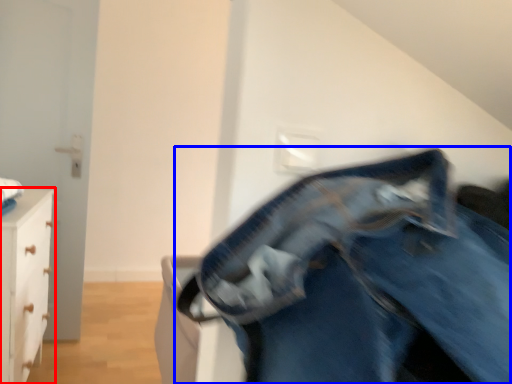
Question: Among these objects, which one is farthest to the camera, chest of drawers (highlighted by a red box) or trousers (highlighted by a blue box)?

Choices:
 (A) chest of drawers
 (B) trousers

Answer: (A)